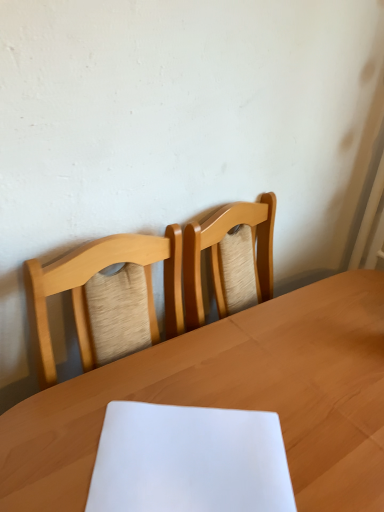
This screenshot has width=384, height=512. Find the location of `free space to the left of white paper at center`. free space to the left of white paper at center is located at coordinates (53, 434).